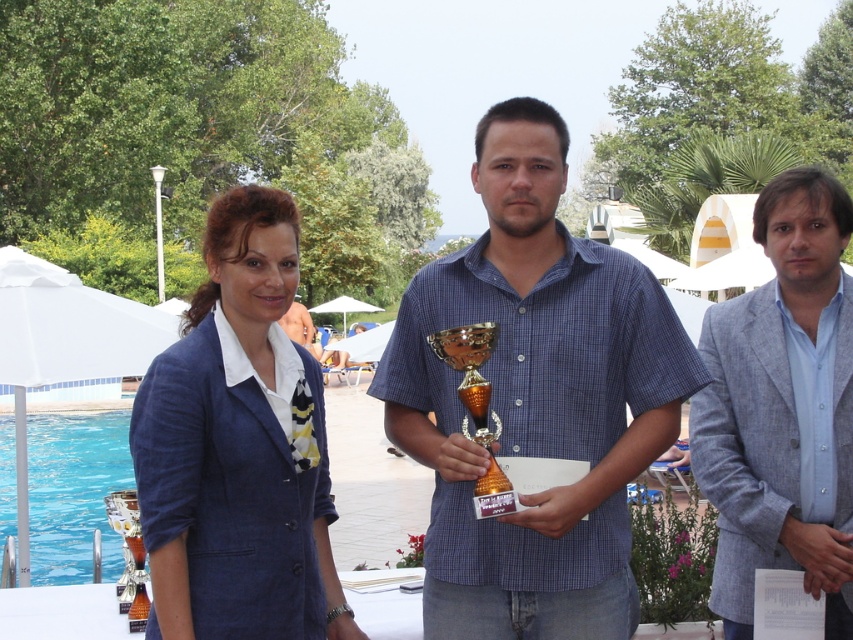
Between gray textured blazer at right and shiny silver trophy at lower left, which one is positioned higher?

gray textured blazer at right is above.

Is gray textured blazer at right positioned behind shiny silver trophy at lower left?

No, gray textured blazer at right is in front of shiny silver trophy at lower left.

Is point (732, 608) farther from camera compared to point (137, 628)?

No.

The image size is (853, 640). What are the coordinates of `gray textured blazer at right` in the screenshot? It's located at (782, 408).

Does blue checkered shirt at center have a greater height compared to gray textured blazer at right?

Indeed, blue checkered shirt at center has a greater height compared to gray textured blazer at right.

Is blue checkered shirt at center smaller than gray textured blazer at right?

Actually, blue checkered shirt at center might be larger than gray textured blazer at right.

Is point (524, 504) positioned after point (714, 600)?

That is False.

This screenshot has width=853, height=640. Identify the location of blue checkered shirt at center. (535, 400).

Is blue checkered shirt at center smaller than gold metallic trophy at center?

No.

Identify the location of blue checkered shirt at center. (535, 400).